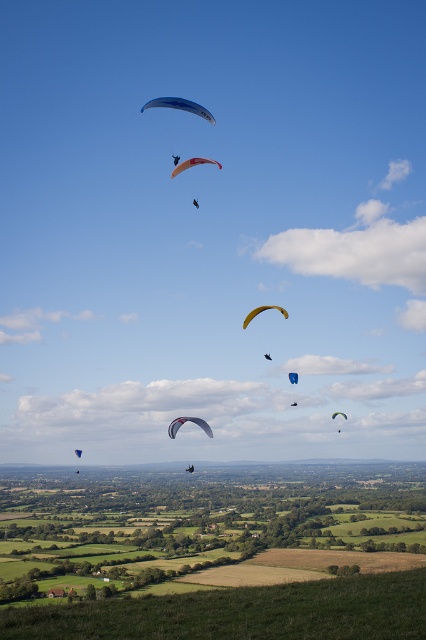
Can you confirm if blue glossy parachute at upper center is wider than matte black paraglider at upper center?

Correct, the width of blue glossy parachute at upper center exceeds that of matte black paraglider at upper center.

Between point (201, 116) and point (193, 205), which one is positioned behind?

Point (193, 205)

Where is `blue glossy parachute at upper center`? blue glossy parachute at upper center is located at coordinates pyautogui.click(x=180, y=106).

Measure the distance from white matte parachute at center to orange fabric parachute at center.

white matte parachute at center is 89.63 meters from orange fabric parachute at center.

Can you confirm if white matte parachute at center is positioned above orange fabric parachute at center?

No.

The image size is (426, 640). Find the location of `white matte parachute at center`. white matte parachute at center is located at coordinates (187, 420).

Is yellow-green fabric parachute at center smaller than matte black paraglider at upper center?

Yes.

Consider the image. Is yellow-green fabric parachute at center thinner than matte black paraglider at upper center?

No.

Between point (284, 308) and point (198, 202), which one is positioned behind?

The point (284, 308) is behind.

Find the location of a particular element. yellow-green fabric parachute at center is located at coordinates (261, 310).